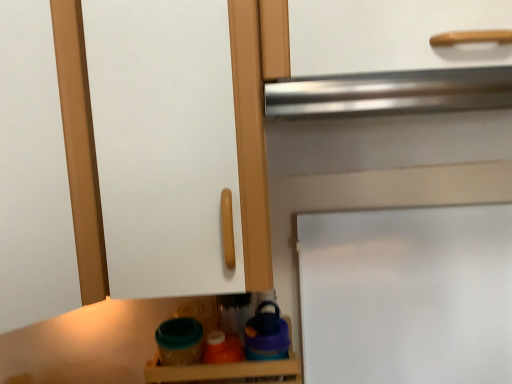
The width and height of the screenshot is (512, 384). What do you see at coordinates (407, 295) in the screenshot?
I see `white matte door at center` at bounding box center [407, 295].

Identify the location of white matte door at center. Image resolution: width=512 pixels, height=384 pixels. (407, 295).

Describe the element at coordinates (226, 372) in the screenshot. The width and height of the screenshot is (512, 384). I see `translucent plastic containers at lower center` at that location.

What is the approximate height of translucent plastic containers at lower center?

translucent plastic containers at lower center is 5.24 inches in height.

Find the location of a particular element. translucent plastic containers at lower center is located at coordinates (226, 372).

Identify the location of white matte door at center. The height and width of the screenshot is (384, 512). (407, 295).

Does white matte door at center appear on the right side of translucent plastic containers at lower center?

Correct, you'll find white matte door at center to the right of translucent plastic containers at lower center.

Which object is closer to the camera, white matte door at center or translucent plastic containers at lower center?

translucent plastic containers at lower center.

Which is nearer, (452, 219) or (210, 379)?

Point (210, 379)

From the image's perspective, between white matte door at center and translucent plastic containers at lower center, which one is located above?

white matte door at center.

From a real-world perspective, does white matte door at center stand above translucent plastic containers at lower center?

Yes, from a real-world perspective, white matte door at center is above translucent plastic containers at lower center.

Can you confirm if white matte door at center is wider than translucent plastic containers at lower center?

No.

From the picture: Does white matte door at center have a greater height compared to translucent plastic containers at lower center?

Yes.

From the picture: Between white matte door at center and translucent plastic containers at lower center, which one has smaller size?

translucent plastic containers at lower center.

Could translucent plastic containers at lower center be considered to be inside white matte door at center?

That's incorrect, translucent plastic containers at lower center is not inside white matte door at center.

Would you consider white matte door at center to be distant from translucent plastic containers at lower center?

Actually, white matte door at center and translucent plastic containers at lower center are a little close together.

Could you tell me if white matte door at center is turned towards translucent plastic containers at lower center?

No, white matte door at center does not turn towards translucent plastic containers at lower center.

Find the location of `door behind the translucent plastic containers at lower center`. door behind the translucent plastic containers at lower center is located at coordinates (407, 295).

Based on their positions, is translucent plastic containers at lower center located to the left or right of white matte door at center?

Clearly, translucent plastic containers at lower center is on the left of white matte door at center in the image.

Which is behind, translucent plastic containers at lower center or white matte door at center?

white matte door at center is further from the camera.

Which is in front, point (263, 377) or point (414, 312)?

The point (263, 377) is closer.

From the image's perspective, between translucent plastic containers at lower center and white matte door at center, who is located below?

translucent plastic containers at lower center appears lower in the image.

From a real-world perspective, is translucent plastic containers at lower center above or below white matte door at center?

In terms of real-world spatial position, translucent plastic containers at lower center is below white matte door at center.

Consider the image. Is translucent plastic containers at lower center wider or thinner than white matte door at center?

translucent plastic containers at lower center is wider than white matte door at center.

Can you confirm if translucent plastic containers at lower center is shorter than white matte door at center?

Correct, translucent plastic containers at lower center is not as tall as white matte door at center.

Does translucent plastic containers at lower center have a larger size compared to white matte door at center?

Actually, translucent plastic containers at lower center might be smaller than white matte door at center.

Is translucent plastic containers at lower center outside of white matte door at center?

Yes, translucent plastic containers at lower center is not within white matte door at center.

Is translucent plastic containers at lower center with white matte door at center?

No, translucent plastic containers at lower center is not in contact with white matte door at center.

Based on the photo, is translucent plastic containers at lower center oriented towards white matte door at center?

No, translucent plastic containers at lower center is not turned towards white matte door at center.

The width and height of the screenshot is (512, 384). Identify the location of shelf below the white matte door at center (from the image's perspective). (226, 372).

Identify the location of door to the right of translucent plastic containers at lower center. (407, 295).

Locate an element on the screen. This screenshot has height=384, width=512. door behind the translucent plastic containers at lower center is located at coordinates (407, 295).